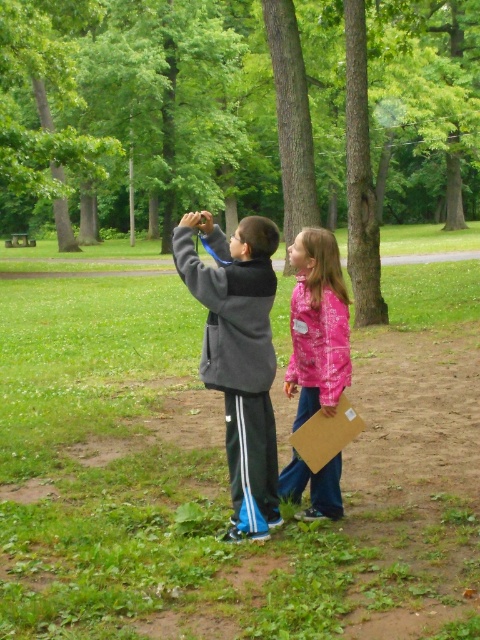
Between point (215, 365) and point (296, 330), which one is positioned behind?

The point (296, 330) is behind.

Which is more to the right, gray fleece jacket at center or pink fabric jacket at lower center?

→ pink fabric jacket at lower center

Which is in front, point (262, 499) or point (309, 296)?

Point (309, 296)

Locate an element on the screen. The width and height of the screenshot is (480, 640). gray fleece jacket at center is located at coordinates (239, 355).

Can you confirm if gray fleece jacket at center is wider than brown cardboard at lower center?

Indeed, gray fleece jacket at center has a greater width compared to brown cardboard at lower center.

Is gray fleece jacket at center closer to camera compared to brown cardboard at lower center?

Yes, it is in front of brown cardboard at lower center.

Is point (240, 369) farther from camera compared to point (314, 440)?

That is False.

I want to click on gray fleece jacket at center, so click(x=239, y=355).

Between point (336, 253) and point (346, 412), which one is positioned in front?

Positioned in front is point (346, 412).

Locate an element on the screen. This screenshot has height=640, width=480. pink fabric jacket at lower center is located at coordinates (317, 324).